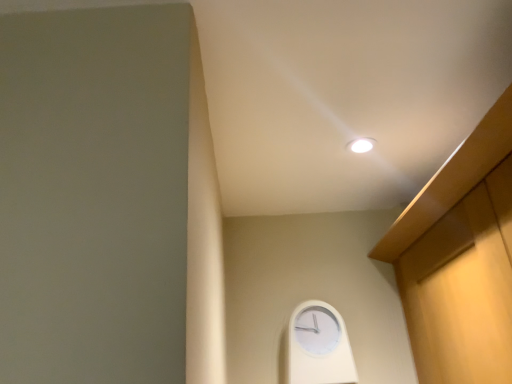
What is the approximate width of white plastic wall clock at lower center?

white plastic wall clock at lower center is 3.36 inches in width.

The image size is (512, 384). I want to click on white plastic wall clock at lower center, so click(319, 346).

Describe the element at coordinates (319, 346) in the screenshot. Image resolution: width=512 pixels, height=384 pixels. I see `white plastic wall clock at lower center` at that location.

This screenshot has width=512, height=384. What are the coordinates of `white plastic wall clock at lower center` in the screenshot? It's located at (319, 346).